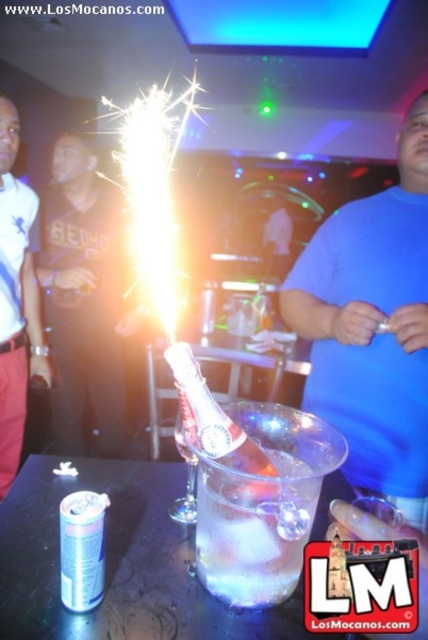
Describe the element at coordinates (85, 296) in the screenshot. I see `black cotton shirt at center` at that location.

Who is more forward, [80,179] or [223,449]?

Point [223,449]

You are a GUI agent. You are given a task and a screenshot of the screen. Output one action in this format:
    pyautogui.click(x=<x>, y=<y>)
    Task: Click on the black cotton shirt at center
    
    Given the screenshot: What is the action you would take?
    pyautogui.click(x=85, y=296)

Can you confirm if clear plastic ice bucket at center is bigger than black cotton shirt at center?

No.

You are a GUI agent. You are given a task and a screenshot of the screen. Output one action in this format:
    pyautogui.click(x=<x>, y=<y>)
    Task: Click on the clear plastic ice bucket at center
    
    Given the screenshot: What is the action you would take?
    pos(118,563)

You are a GUI agent. You are given a task and a screenshot of the screen. Output one action in this format:
    pyautogui.click(x=<x>, y=<y>)
    Task: Click on the clear plastic ice bucket at center
    
    Given the screenshot: What is the action you would take?
    pyautogui.click(x=118, y=563)

Can you confirm if blue matte shirt at center is shorter than clear glass ice bucket at center?

In fact, blue matte shirt at center may be taller than clear glass ice bucket at center.

Does blue matte shirt at center lie behind clear glass ice bucket at center?

Yes, blue matte shirt at center is behind clear glass ice bucket at center.

Identify the location of blue matte shirt at center. The image size is (428, 640). (372, 326).